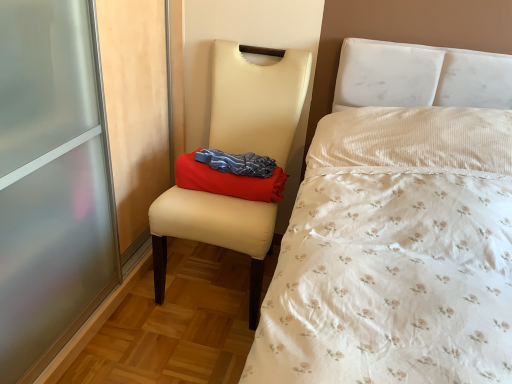
Identify the location of free space underneath matte cream chair at center (from a real-world perspective). (218, 279).